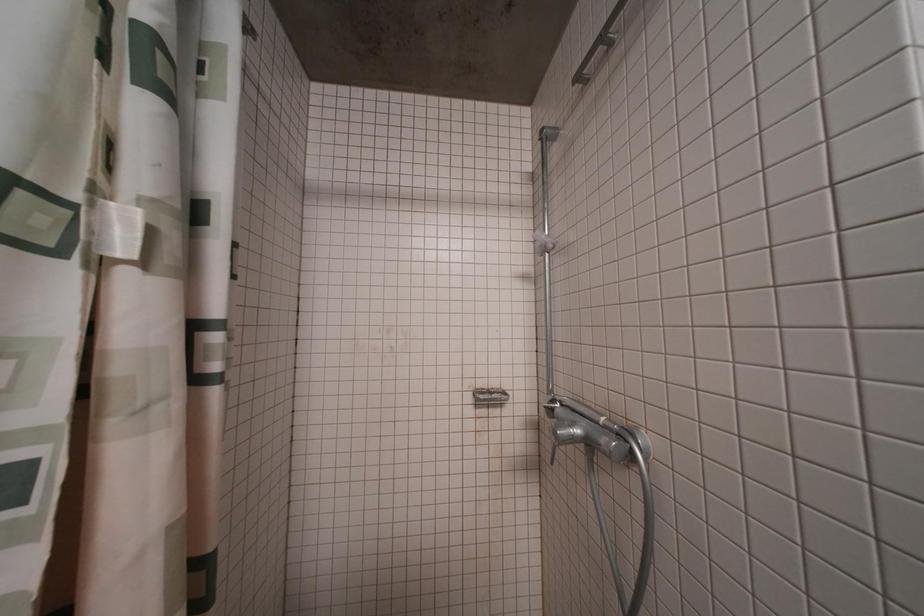
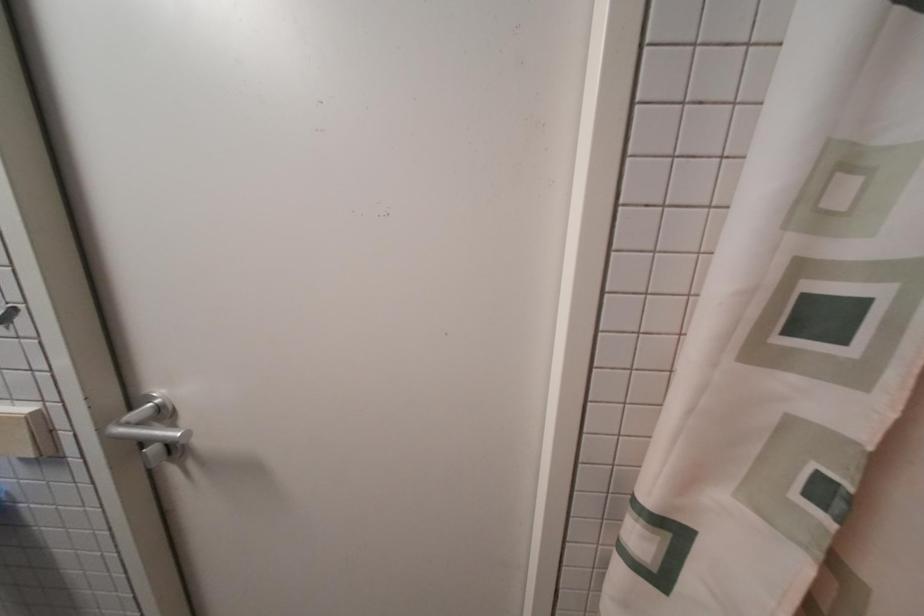
Question: The first image is from the beginning of the video and the second image is from the end. How did the camera likely rotate when shooting the video?

Choices:
 (A) Left
 (B) Right
 (C) Up
 (D) Down

Answer: (A)